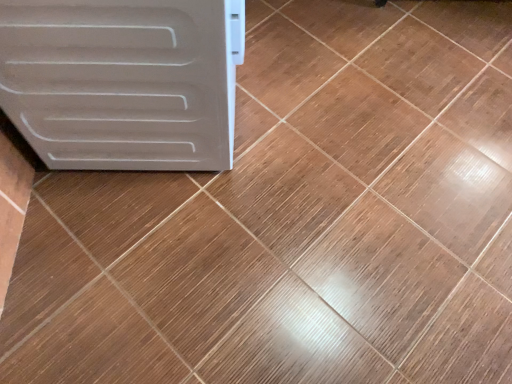
Find the location of a particular element. Image resolution: width=512 pixels, height=384 pixels. vacant area in front of matte plastic door at lower left is located at coordinates (154, 259).